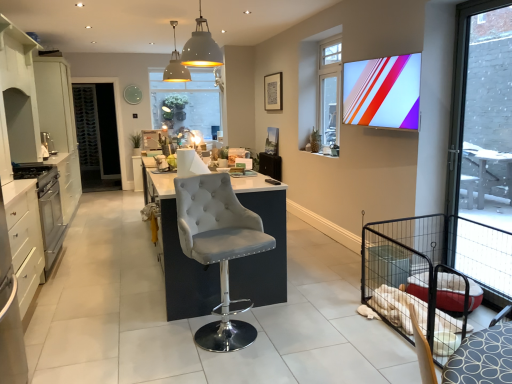
Question: Considering the relative positions of matte plastic tv at upper right and satin silver oven at left, the second appliance in the bottom-to-top sequence, in the image provided, is matte plastic tv at upper right to the left of satin silver oven at left, the second appliance in the bottom-to-top sequence, from the viewer's perspective?

Choices:
 (A) yes
 (B) no

Answer: (B)

Question: From the image's perspective, is matte plastic tv at upper right beneath satin silver oven at left, placed as the third appliance when sorted from back to front?

Choices:
 (A) yes
 (B) no

Answer: (B)

Question: Is matte plastic tv at upper right at the right side of satin silver oven at left, the second appliance in the bottom-to-top sequence?

Choices:
 (A) yes
 (B) no

Answer: (A)

Question: Is matte plastic tv at upper right smaller than satin silver oven at left, arranged as the 1th appliance when viewed from the front?

Choices:
 (A) no
 (B) yes

Answer: (A)

Question: Is matte plastic tv at upper right looking in the opposite direction of satin silver oven at left, the second appliance viewed from the top?

Choices:
 (A) no
 (B) yes

Answer: (A)

Question: Considering the positions of clear glass window at upper center, the 2th window viewed from the back, and satin silver oven at left, the second appliance viewed from the top, in the image, is clear glass window at upper center, the 2th window viewed from the back, bigger or smaller than satin silver oven at left, the second appliance viewed from the top,?

Choices:
 (A) small
 (B) big

Answer: (B)

Question: Is clear glass window at upper center, marked as the 2th window in a left-to-right arrangement, spatially inside satin silver oven at left, the second appliance viewed from the top, or outside of it?

Choices:
 (A) inside
 (B) outside

Answer: (B)

Question: From a real-world perspective, is clear glass window at upper center, which appears as the 2th window when viewed from the right, physically located above or below satin silver oven at left, the second appliance viewed from the top?

Choices:
 (A) below
 (B) above

Answer: (B)

Question: In the image, is clear glass window at upper center, marked as the 2th window in a left-to-right arrangement, on the left side or the right side of satin silver oven at left, placed as the third appliance when sorted from back to front?

Choices:
 (A) right
 (B) left

Answer: (A)

Question: Based on their sizes in the image, would you say matte white picture frame at upper center is bigger or smaller than clear glass door at right, the 1th window when ordered from right to left?

Choices:
 (A) small
 (B) big

Answer: (A)

Question: In the image, is matte white picture frame at upper center positioned in front of or behind clear glass door at right, acting as the third window starting from the back?

Choices:
 (A) front
 (B) behind

Answer: (B)

Question: In terms of height, does matte white picture frame at upper center look taller or shorter compared to clear glass door at right, the 1th window when ordered from right to left?

Choices:
 (A) short
 (B) tall

Answer: (A)

Question: From the image's perspective, is matte white picture frame at upper center located above or below clear glass door at right, acting as the third window starting from the back?

Choices:
 (A) below
 (B) above

Answer: (B)

Question: Is point (178, 57) positioned closer to the camera than point (49, 142)?

Choices:
 (A) farther
 (B) closer

Answer: (A)

Question: Relative to satin silver toaster at left, the 1th appliance viewed from the top, is matte white dome at center, which is the second light fixture in right-to-left order, in front or behind?

Choices:
 (A) behind
 (B) front

Answer: (B)